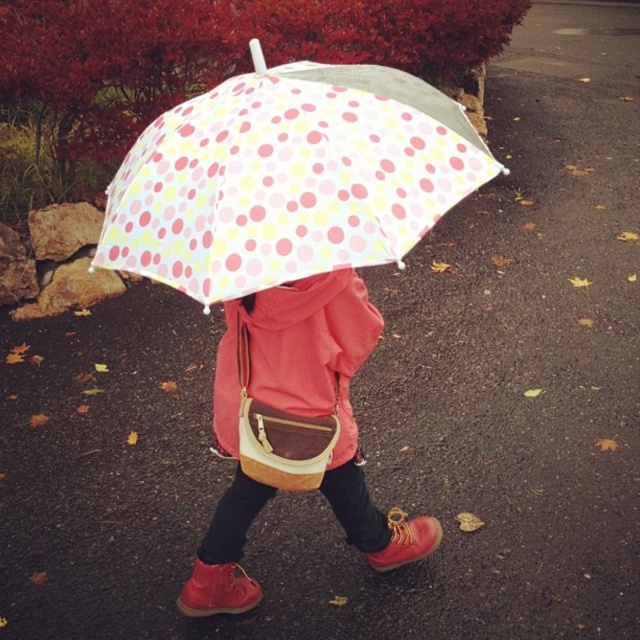
You are a photographer trying to capture the person holding the polka dot fabric umbrella at center and the matte yellow crossbody bag at center. Which object is shorter in height?

The polka dot fabric umbrella at center is not as tall as the matte yellow crossbody bag at center, so the polka dot fabric umbrella at center is shorter in height.

You are a fashion designer observing the person walking away with their matte yellow crossbody bag at center and matte pink jacket at center. Which item appears taller when viewed from behind?

The matte yellow crossbody bag at center has a greater height compared to the matte pink jacket at center, so the bag appears taller when viewed from behind.

You are a fashion designer observing the person walking with the colorful umbrella. You need to determine the spatial relationship between the matte yellow crossbody bag at center and the matte pink jacket at center. Which item is positioned lower on the person?

The matte yellow crossbody bag at center is positioned lower than the matte pink jacket at center.